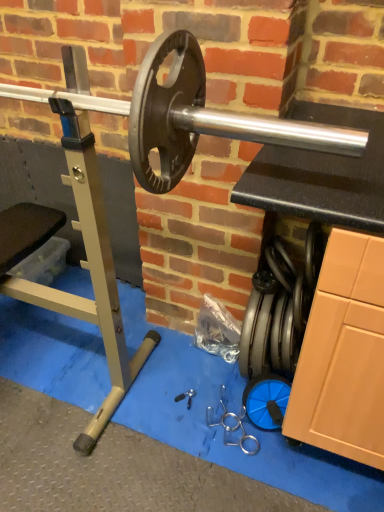
The image size is (384, 512). What do you see at coordinates (182, 114) in the screenshot?
I see `silver metallic barbell at center` at bounding box center [182, 114].

Where is `silver metallic barbell at center`? silver metallic barbell at center is located at coordinates (182, 114).

What is the approximate width of silver metallic barbell at center?

The width of silver metallic barbell at center is 16.61 inches.

I want to click on metallic silver tool at center, so click(185, 397).

Describe the element at coordinates (185, 397) in the screenshot. The height and width of the screenshot is (512, 384). I see `metallic silver tool at center` at that location.

I want to click on silver metallic barbell at center, so click(x=182, y=114).

Considering the positions of objects silver metallic barbell at center and metallic silver tool at center in the image provided, who is more to the right, silver metallic barbell at center or metallic silver tool at center?

From the viewer's perspective, metallic silver tool at center appears more on the right side.

Does silver metallic barbell at center come in front of metallic silver tool at center?

Yes, silver metallic barbell at center is closer to the camera.

Is point (169, 163) in front of point (189, 403)?

Yes.

From the image's perspective, is silver metallic barbell at center located above metallic silver tool at center?

Yes, from the image's perspective, silver metallic barbell at center is above metallic silver tool at center.

From a real-world perspective, which object stands above the other?

In real-world perspective, silver metallic barbell at center is above.

Which object is wider, silver metallic barbell at center or metallic silver tool at center?

silver metallic barbell at center.

Looking at this image, considering the relative sizes of silver metallic barbell at center and metallic silver tool at center in the image provided, is silver metallic barbell at center taller than metallic silver tool at center?

Correct, silver metallic barbell at center is much taller as metallic silver tool at center.

Considering the relative sizes of silver metallic barbell at center and metallic silver tool at center in the image provided, is silver metallic barbell at center bigger than metallic silver tool at center?

Yes.

Would you say silver metallic barbell at center is inside or outside metallic silver tool at center?

silver metallic barbell at center is spatially situated outside metallic silver tool at center.

Is silver metallic barbell at center far away from metallic silver tool at center?

That's right, there is a large distance between silver metallic barbell at center and metallic silver tool at center.

Could you tell me if silver metallic barbell at center is facing metallic silver tool at center?

No, silver metallic barbell at center is not aimed at metallic silver tool at center.

How many degrees apart are the facing directions of silver metallic barbell at center and metallic silver tool at center?

The facing directions of silver metallic barbell at center and metallic silver tool at center are 3.62 degrees apart.

Measure the distance between silver metallic barbell at center and metallic silver tool at center.

1.01 meters.

I want to click on tool lying below the silver metallic barbell at center (from the image's perspective), so click(185, 397).

Visually, is metallic silver tool at center positioned to the left or to the right of silver metallic barbell at center?

Based on their positions, metallic silver tool at center is located to the right of silver metallic barbell at center.

Does metallic silver tool at center lie behind silver metallic barbell at center?

Yes, it is.

Does point (183, 398) come closer to viewer compared to point (235, 132)?

No, it is behind (235, 132).

From the image's perspective, is metallic silver tool at center located beneath silver metallic barbell at center?

Yes.

From a real-world perspective, between metallic silver tool at center and silver metallic barbell at center, who is vertically lower?

In real-world perspective, metallic silver tool at center is lower.

Which of these two, metallic silver tool at center or silver metallic barbell at center, is thinner?

metallic silver tool at center is thinner.

Considering the relative sizes of metallic silver tool at center and silver metallic barbell at center in the image provided, is metallic silver tool at center shorter than silver metallic barbell at center?

Yes.

Between metallic silver tool at center and silver metallic barbell at center, which one has larger size?

Bigger between the two is silver metallic barbell at center.

Is metallic silver tool at center situated inside silver metallic barbell at center or outside?

metallic silver tool at center cannot be found inside silver metallic barbell at center.

Is metallic silver tool at center far from silver metallic barbell at center?

Yes, metallic silver tool at center and silver metallic barbell at center are quite far apart.

Is metallic silver tool at center oriented away from silver metallic barbell at center?

No, metallic silver tool at center's orientation is not away from silver metallic barbell at center.

Find the location of a particular element. Image resolution: width=384 pixels, height=512 pixels. barbell in front of the metallic silver tool at center is located at coordinates (182, 114).

Identify the location of tool behind the silver metallic barbell at center. This screenshot has width=384, height=512. (185, 397).

Find the location of `tool beneath the silver metallic barbell at center (from a real-world perspective)`. tool beneath the silver metallic barbell at center (from a real-world perspective) is located at coordinates (185, 397).